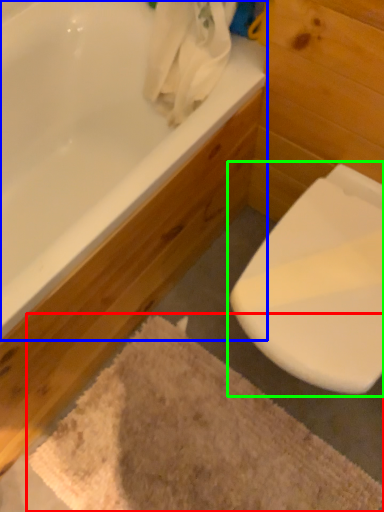
Question: Based on their relative distances, which object is farther from bath mat (highlighted by a red box)? Choose from bathtub (highlighted by a blue box) and toilet (highlighted by a green box).

Choices:
 (A) bathtub
 (B) toilet

Answer: (A)